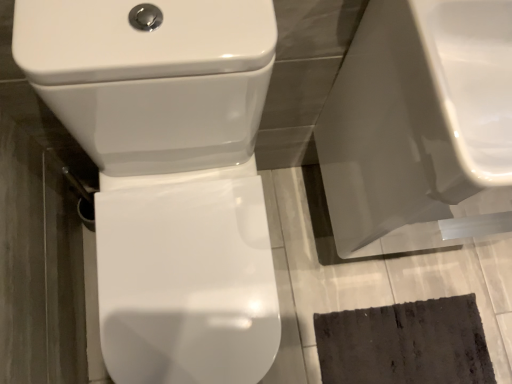
Question: Is white glossy toilet at center at the right side of white glossy toilet seat at center?

Choices:
 (A) yes
 (B) no

Answer: (B)

Question: Is white glossy toilet at center shorter than white glossy toilet seat at center?

Choices:
 (A) yes
 (B) no

Answer: (B)

Question: From a real-world perspective, is white glossy toilet at center below white glossy toilet seat at center?

Choices:
 (A) yes
 (B) no

Answer: (B)

Question: Is white glossy toilet at center further to the viewer compared to white glossy toilet seat at center?

Choices:
 (A) yes
 (B) no

Answer: (B)

Question: Is white glossy toilet at center thinner than white glossy toilet seat at center?

Choices:
 (A) yes
 (B) no

Answer: (A)

Question: In the image, is glossy ceramic sink at upper right on the left side or the right side of white glossy toilet at center?

Choices:
 (A) right
 (B) left

Answer: (A)

Question: From the image's perspective, is glossy ceramic sink at upper right located above or below white glossy toilet at center?

Choices:
 (A) below
 (B) above

Answer: (B)

Question: Choose the correct answer: Is glossy ceramic sink at upper right inside white glossy toilet at center or outside it?

Choices:
 (A) outside
 (B) inside

Answer: (A)

Question: Looking at their shapes, would you say glossy ceramic sink at upper right is wider or thinner than white glossy toilet at center?

Choices:
 (A) thin
 (B) wide

Answer: (A)

Question: Is white glossy toilet seat at center wider or thinner than white glossy toilet at center?

Choices:
 (A) thin
 (B) wide

Answer: (B)

Question: Considering the positions of point (495, 241) and point (270, 329), is point (495, 241) closer or farther from the camera than point (270, 329)?

Choices:
 (A) farther
 (B) closer

Answer: (A)

Question: From their relative heights in the image, would you say white glossy toilet seat at center is taller or shorter than white glossy toilet at center?

Choices:
 (A) short
 (B) tall

Answer: (A)

Question: In the image, is white glossy toilet seat at center positioned in front of or behind white glossy toilet at center?

Choices:
 (A) front
 (B) behind

Answer: (B)

Question: From the image's perspective, is white glossy toilet at center above or below glossy ceramic sink at upper right?

Choices:
 (A) below
 (B) above

Answer: (A)

Question: Is white glossy toilet at center wider or thinner than glossy ceramic sink at upper right?

Choices:
 (A) wide
 (B) thin

Answer: (A)